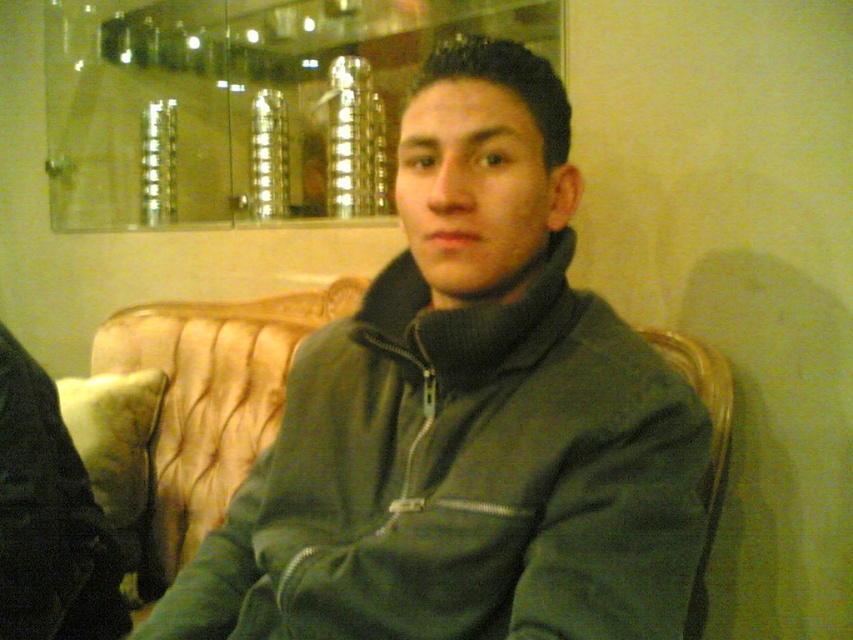
From the picture: You are a photographer setting up a shoot in this living room. You need to place a small prop exactly at point (466, 417). However, there is already an object there. What object is blocking the placement of your prop at that point?

The green matte jacket at center is located at point (466, 417), so it is blocking the placement of the prop there.

You are standing in a living room and see a person sitting on a couch. There is a point marked at coordinates (466, 417). What object is located at that point?

The point at coordinates (466, 417) marks the green matte jacket at center.